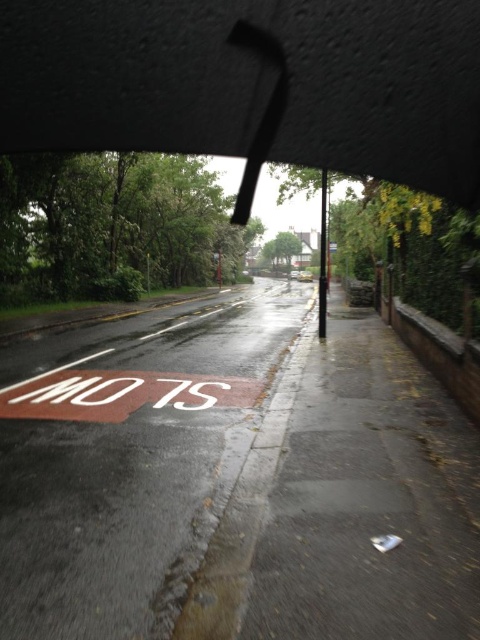
You are standing under the transparent plastic umbrella at upper center. You want to look at the SLOW sign on the left side of the road. In which direction should you move your head to see it?

You should move your head to the left to see the SLOW sign on the left side of the road because the transparent plastic umbrella at upper center is located at the upper center, and the SLOW sign is on the left side of the road.